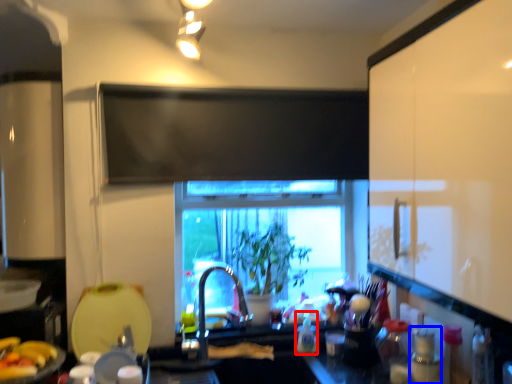
Question: Which of the following is the closest to the observer, bottle (highlighted by a red box) or bottle (highlighted by a blue box)?

Choices:
 (A) bottle
 (B) bottle

Answer: (B)